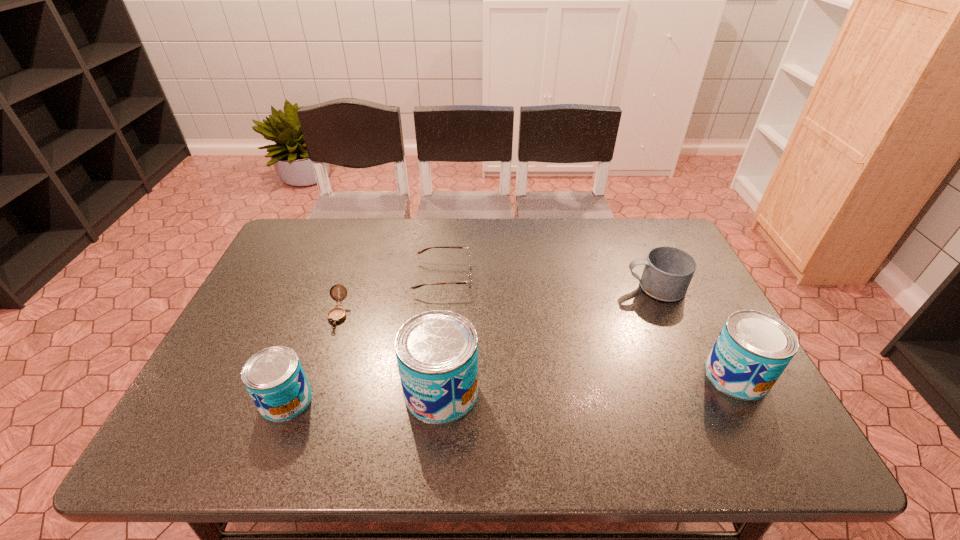
Identify the location of mug located at the right edge. (668, 271).

Find the location of a particular element. The width and height of the screenshot is (960, 540). object located in the near left corner section of the desktop is located at coordinates (274, 377).

Image resolution: width=960 pixels, height=540 pixels. Find the location of `object present at the near right corner`. object present at the near right corner is located at coordinates (753, 349).

In the image, there is a desktop. Where is `free space at the far edge`? free space at the far edge is located at coordinates click(627, 248).

Image resolution: width=960 pixels, height=540 pixels. I want to click on free space at the near edge, so click(356, 399).

This screenshot has width=960, height=540. I want to click on free space at the left edge of the desktop, so click(289, 269).

Where is `free region at the right edge`? The image size is (960, 540). free region at the right edge is located at coordinates (680, 349).

The image size is (960, 540). In order to click on vacant area at the far left corner of the desktop in this screenshot , I will do `click(315, 231)`.

Locate an element on the screen. Image resolution: width=960 pixels, height=540 pixels. vacant point located between the second can from right to left and the compass is located at coordinates (390, 353).

At what (x,y) coordinates should I click in order to perform the action: click on free space between the mug and the spectacles. Please return your answer as a coordinate pair (x, y). Looking at the image, I should click on 549,282.